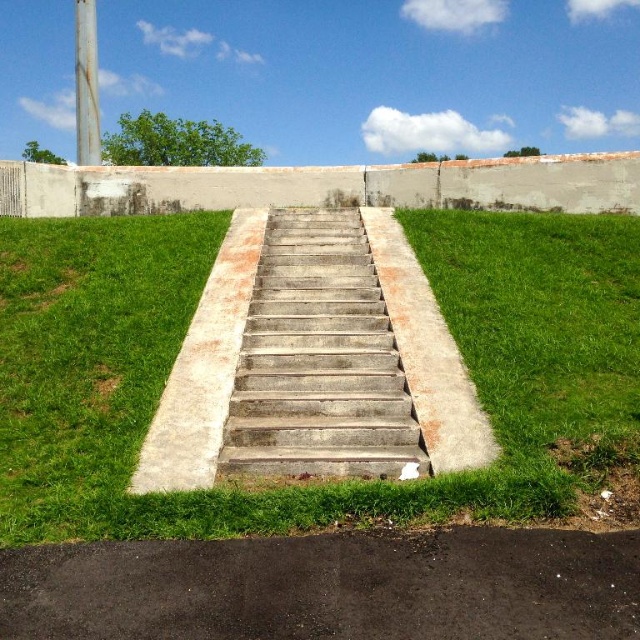
Looking at this image, you are a gardener who needs to water the green grass at center and the dark gray asphalt at lower center. You have a hose that can reach 6 feet. Can you water both areas without moving the hose?

The green grass at center and dark gray asphalt at lower center are 7.16 feet apart. Since the hose can only reach 6 feet, you cannot water both areas without moving the hose.

You are a gardener planning to mow the lawn. You notice the green grass at center and the dark gray asphalt at lower center. Which area has a wider spread?

The green grass at center has a wider spread than the dark gray asphalt at lower center, as its width is larger according to the description.